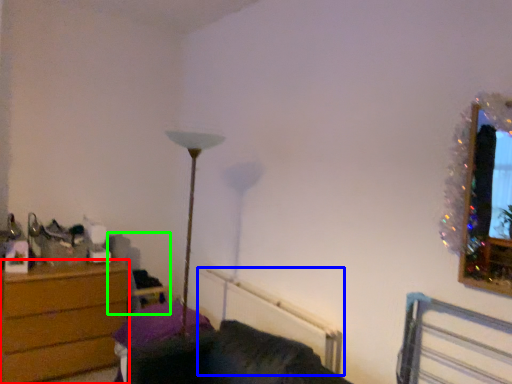
Question: Based on their relative distances, which object is nearer to chest of drawers (highlighted by a red box)? Choose from radiator (highlighted by a blue box) and swivel chair (highlighted by a green box).

Choices:
 (A) radiator
 (B) swivel chair

Answer: (B)